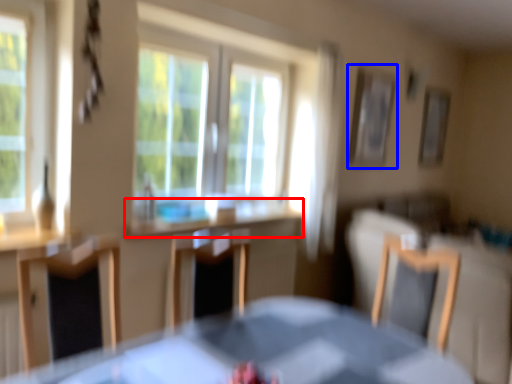
Question: Which object appears closest to the camera in this image, counter top (highlighted by a red box) or picture frame (highlighted by a blue box)?

Choices:
 (A) counter top
 (B) picture frame

Answer: (A)